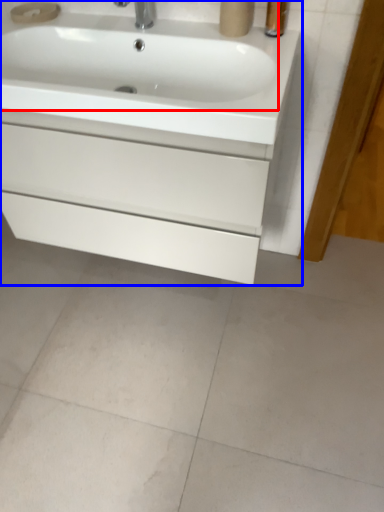
Question: Among these objects, which one is farthest to the camera, sink (highlighted by a red box) or bathroom cabinet (highlighted by a blue box)?

Choices:
 (A) sink
 (B) bathroom cabinet

Answer: (B)